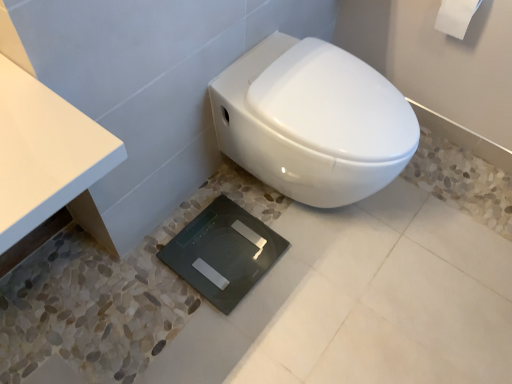
Question: Does white matte toilet paper at upper right appear on the right side of black glass scale at center?

Choices:
 (A) no
 (B) yes

Answer: (B)

Question: From a real-world perspective, is white matte toilet paper at upper right physically below black glass scale at center?

Choices:
 (A) yes
 (B) no

Answer: (B)

Question: Is white matte toilet paper at upper right bigger than black glass scale at center?

Choices:
 (A) no
 (B) yes

Answer: (A)

Question: Considering the relative sizes of white matte toilet paper at upper right and black glass scale at center in the image provided, is white matte toilet paper at upper right shorter than black glass scale at center?

Choices:
 (A) yes
 (B) no

Answer: (B)

Question: Is black glass scale at center surrounded by white matte toilet paper at upper right?

Choices:
 (A) yes
 (B) no

Answer: (B)

Question: Does white matte toilet paper at upper right have a greater width compared to black glass scale at center?

Choices:
 (A) yes
 (B) no

Answer: (B)

Question: Is black glass scale at center to the left of white glossy toilet at center from the viewer's perspective?

Choices:
 (A) no
 (B) yes

Answer: (B)

Question: Is black glass scale at center positioned before white glossy toilet at center?

Choices:
 (A) no
 (B) yes

Answer: (A)

Question: Does black glass scale at center touch white glossy toilet at center?

Choices:
 (A) no
 (B) yes

Answer: (A)

Question: Considering the relative sizes of black glass scale at center and white glossy toilet at center in the image provided, is black glass scale at center smaller than white glossy toilet at center?

Choices:
 (A) yes
 (B) no

Answer: (A)

Question: Is black glass scale at center positioned with its back to white glossy toilet at center?

Choices:
 (A) no
 (B) yes

Answer: (A)

Question: Does black glass scale at center appear on the right side of white glossy toilet at center?

Choices:
 (A) no
 (B) yes

Answer: (A)

Question: Is white matte toilet paper at upper right directly adjacent to white glossy toilet at center?

Choices:
 (A) yes
 (B) no

Answer: (B)